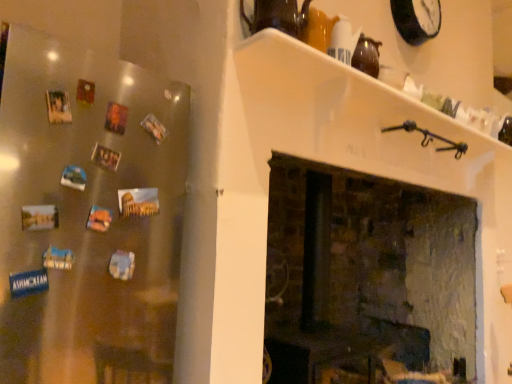
Question: Can you confirm if black plastic clock at upper right is shorter than white glossy shelf at upper center?

Choices:
 (A) yes
 (B) no

Answer: (B)

Question: Is black plastic clock at upper right far from white glossy shelf at upper center?

Choices:
 (A) no
 (B) yes

Answer: (A)

Question: From the image's perspective, is black plastic clock at upper right on white glossy shelf at upper center?

Choices:
 (A) yes
 (B) no

Answer: (A)

Question: From a real-world perspective, is black plastic clock at upper right below white glossy shelf at upper center?

Choices:
 (A) no
 (B) yes

Answer: (A)

Question: From the image's perspective, is black plastic clock at upper right below white glossy shelf at upper center?

Choices:
 (A) no
 (B) yes

Answer: (A)

Question: Is matte brown teapot at upper center to the left or to the right of black plastic clock at upper right in the image?

Choices:
 (A) left
 (B) right

Answer: (A)

Question: Is matte brown teapot at upper center taller or shorter than black plastic clock at upper right?

Choices:
 (A) tall
 (B) short

Answer: (B)

Question: In terms of width, does matte brown teapot at upper center look wider or thinner when compared to black plastic clock at upper right?

Choices:
 (A) thin
 (B) wide

Answer: (B)

Question: Considering their positions, is matte brown teapot at upper center located in front of or behind black plastic clock at upper right?

Choices:
 (A) front
 (B) behind

Answer: (A)

Question: From their relative heights in the image, would you say rustic brick fireplace at center is taller or shorter than satin silver fridge magnets at left?

Choices:
 (A) short
 (B) tall

Answer: (B)

Question: From the image's perspective, is rustic brick fireplace at center positioned above or below satin silver fridge magnets at left?

Choices:
 (A) below
 (B) above

Answer: (A)

Question: From a real-world perspective, relative to satin silver fridge magnets at left, is rustic brick fireplace at center vertically above or below?

Choices:
 (A) below
 (B) above

Answer: (A)

Question: Is rustic brick fireplace at center situated inside satin silver fridge magnets at left or outside?

Choices:
 (A) inside
 (B) outside

Answer: (B)

Question: Is point (91, 296) positioned closer to the camera than point (294, 9)?

Choices:
 (A) closer
 (B) farther

Answer: (A)

Question: From the image's perspective, relative to matte brown teapot at upper center, is satin silver fridge magnets at left above or below?

Choices:
 (A) above
 (B) below

Answer: (B)